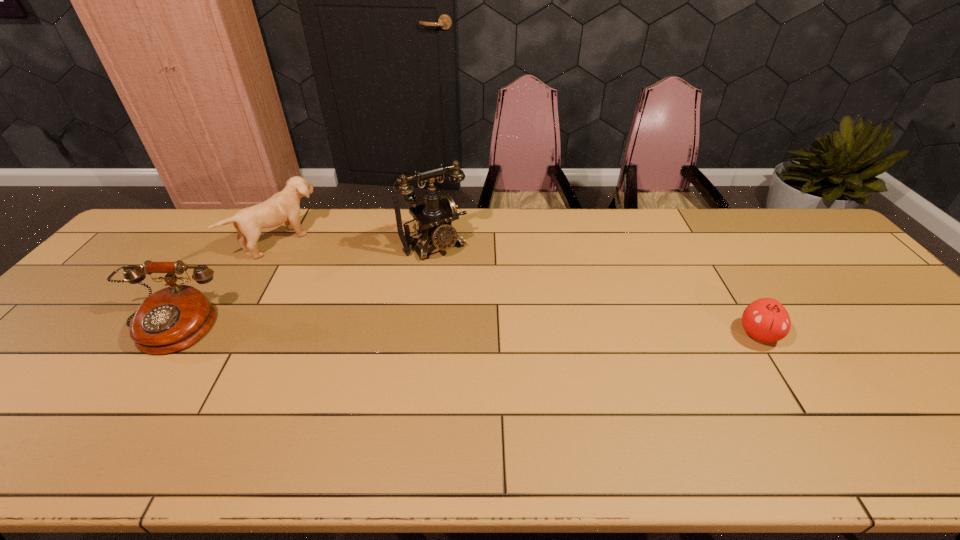
In order to click on blank area located on the rotary dial of the right telephone in this screenshot , I will do `click(513, 335)`.

Where is `vacant space located 0.370m on the rotary dial of the right telephone`? vacant space located 0.370m on the rotary dial of the right telephone is located at coordinates click(516, 340).

Image resolution: width=960 pixels, height=540 pixels. I want to click on free space located 0.350m on the left side of the puppy, so click(x=374, y=310).

The image size is (960, 540). What are the coordinates of `vacant space located 0.150m on the left side of the puppy` in the screenshot? It's located at (331, 278).

At what (x,y) coordinates should I click in order to perform the action: click on free spot located 0.190m on the left side of the puppy. Please return your answer as a coordinate pair (x, y). Looking at the image, I should click on (339, 285).

Locate an element on the screen. telephone located at the far edge is located at coordinates [435, 217].

I want to click on puppy present at the far edge, so click(x=283, y=207).

Where is `vacant space at the far edge of the desktop`? vacant space at the far edge of the desktop is located at coordinates (361, 215).

Where is `vacant region at the near edge of the desktop`? vacant region at the near edge of the desktop is located at coordinates (71, 385).

Locate an element on the screen. This screenshot has height=540, width=960. vacant region at the left edge of the desktop is located at coordinates (x=57, y=347).